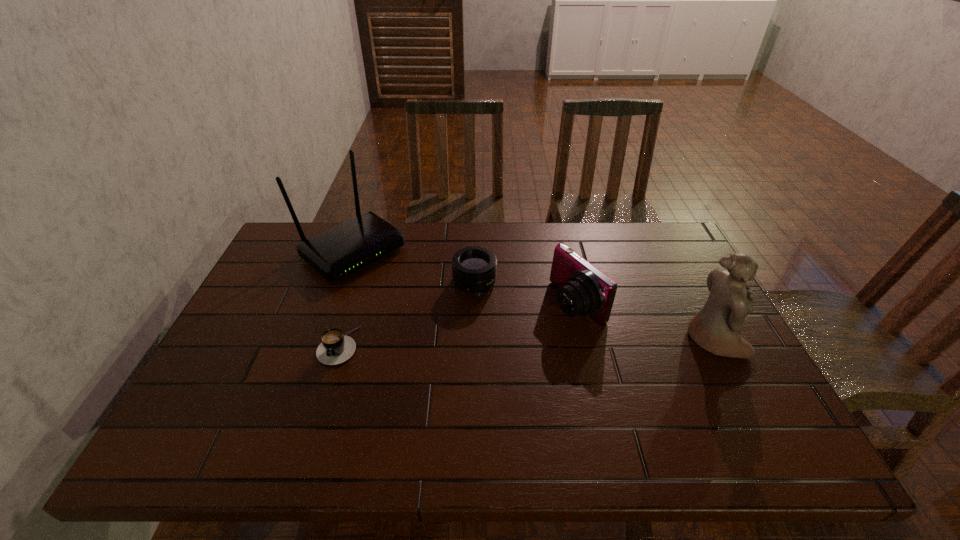
I want to click on free space on the desktop that is between the cappuccino and the figurine and is positioned on the side of the third object from right to left with brand markings and control switches, so click(x=492, y=343).

Locate an element on the screen. This screenshot has width=960, height=540. free space on the desktop that is between the shortest object and the figurine and is positioned on the front-facing side of the fourth object from left to right is located at coordinates (499, 343).

What are the coordinates of `vacant space on the desktop that is between the shortest object and the figurine and is positioned on the front-facing side of the router` in the screenshot? It's located at (472, 343).